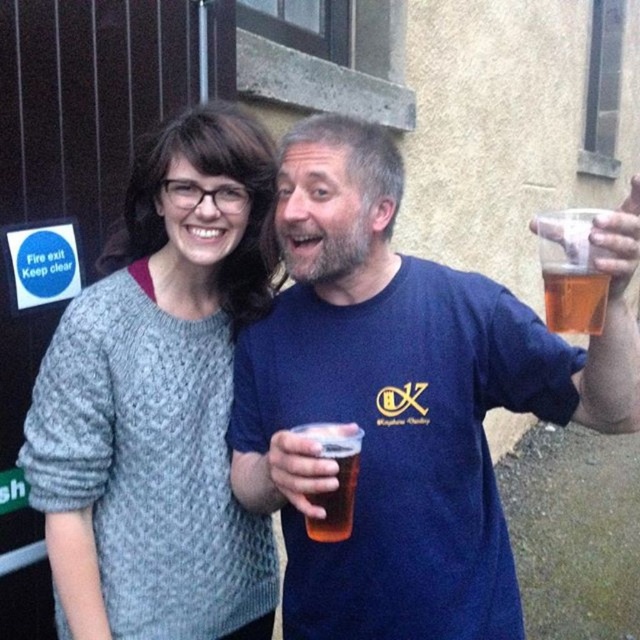
Question: Which point is closer to the camera?

Choices:
 (A) blue cotton t-shirt at center
 (B) translucent plastic cup at upper right
 (C) translucent plastic cup at center
 (D) knitted gray sweater at left

Answer: (A)

Question: Is blue cotton t-shirt at center in front of knitted gray sweater at left?

Choices:
 (A) yes
 (B) no

Answer: (A)

Question: Does blue cotton t-shirt at center appear on the right side of translucent plastic cup at center?

Choices:
 (A) no
 (B) yes

Answer: (B)

Question: Which object appears farthest from the camera in this image?

Choices:
 (A) knitted gray sweater at left
 (B) blue cotton t-shirt at center
 (C) translucent plastic cup at center

Answer: (A)

Question: Is blue cotton t-shirt at center below translucent plastic cup at center?

Choices:
 (A) yes
 (B) no

Answer: (B)

Question: Among these objects, which one is nearest to the camera?

Choices:
 (A) knitted gray sweater at left
 (B) translucent plastic cup at center
 (C) translucent plastic cup at upper right

Answer: (C)